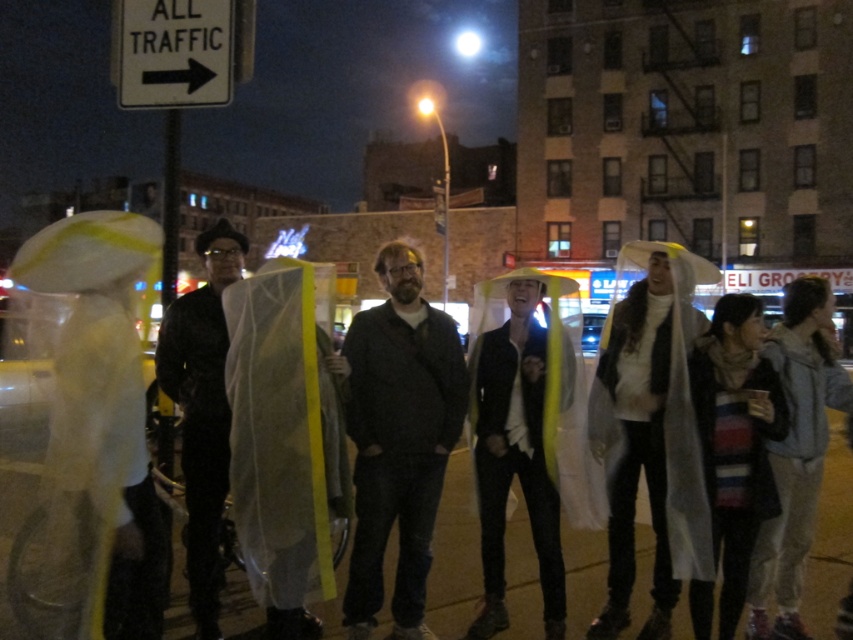
You are organizing an outdoor event and need to ensure that the translucent yellow raincoat at center can fit into a storage box designed for the white plastic sign at upper left. Based on their sizes, will the raincoat fit inside the box?

The translucent yellow raincoat at center is narrower than the white plastic sign at upper left, so it should fit inside the box designed for the sign.

In the scene shown: You are a photographer trying to capture the scene with your camera. You want to focus on the dark gray cotton jacket at center and the white plastic sign at upper left. Which object should you adjust your camera focus to first if you want to capture both in one shot?

The dark gray cotton jacket at center is positioned on the right side of white plastic sign at upper left. Since the jacket is closer to the camera than the sign, you should focus on the white plastic sign at upper left first to ensure both are in focus.

You are a photographer trying to capture a clear shot of both the translucent yellow raincoat at center and the black matte coat at center. Since the scene is lit by a bright streetlamp, you notice that one of the coats reflects more light. Which coat would you expect to reflect more light and why?

The translucent yellow raincoat at center would reflect more light because its yellow edges and transparent material likely have higher reflectivity compared to the black matte coat at center, which absorbs more light due to its matte and dark color.